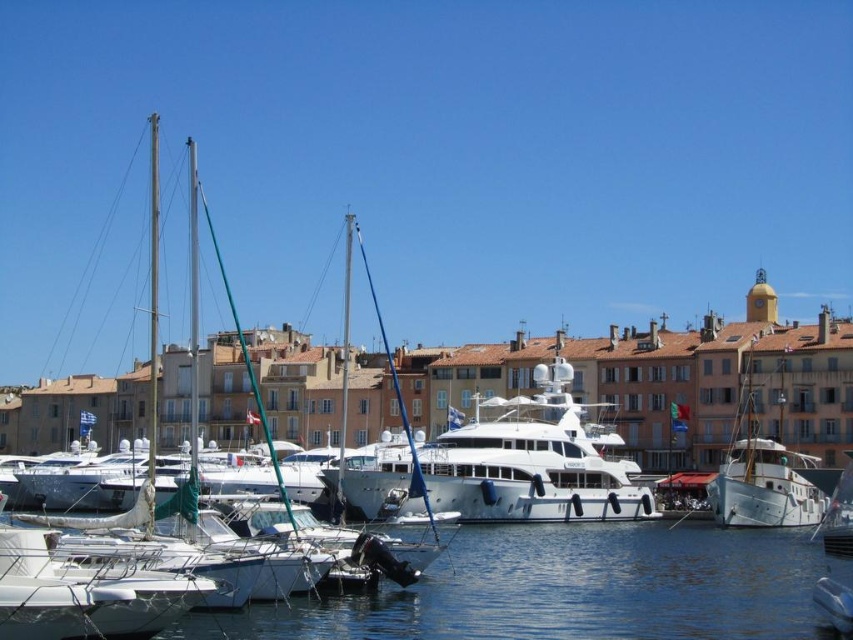
Question: Considering the real-world distances, which object is closest to the white glossy sailboat at left?

Choices:
 (A) white wooden sailboat at right
 (B) clear blue water at lower center

Answer: (B)

Question: Observing the image, what is the correct spatial positioning of white glossy yacht at center in reference to white glossy sailboat at left?

Choices:
 (A) left
 (B) right

Answer: (B)

Question: Which point is farther to the camera?

Choices:
 (A) clear blue water at lower center
 (B) white wooden sailboat at right
 (C) white glossy yacht at center
 (D) white glossy sailboat at left

Answer: (B)

Question: Estimate the real-world distances between objects in this image. Which object is closer to the white wooden sailboat at right?

Choices:
 (A) white glossy sailboat at left
 (B) white glossy yacht at center

Answer: (B)

Question: Does clear blue water at lower center come behind white wooden sailboat at right?

Choices:
 (A) no
 (B) yes

Answer: (A)

Question: Can you confirm if white glossy yacht at center is bigger than white wooden sailboat at right?

Choices:
 (A) no
 (B) yes

Answer: (B)